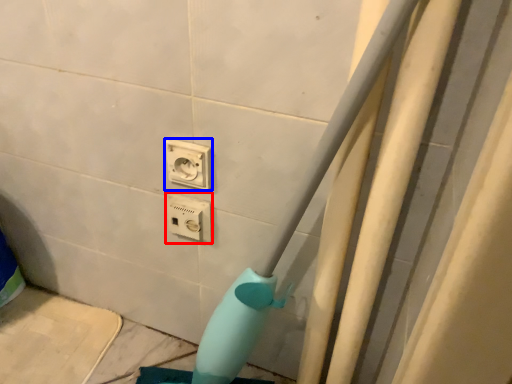
Question: Which point is closer to the camera, power plugs and sockets (highlighted by a red box) or power plugs and sockets (highlighted by a blue box)?

Choices:
 (A) power plugs and sockets
 (B) power plugs and sockets

Answer: (B)